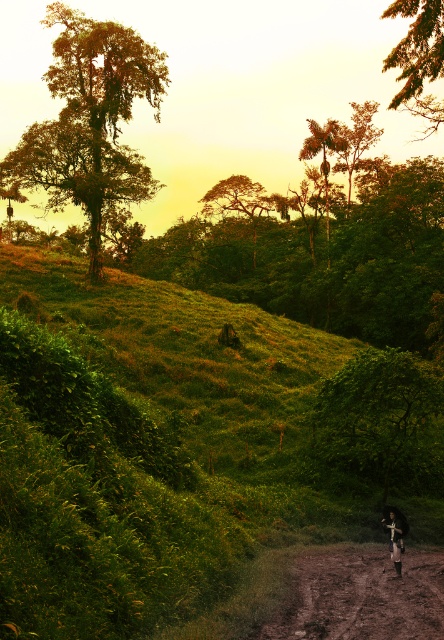
Question: Which object is positioned closest to the green leafy tree at upper right?

Choices:
 (A) brown dirt track at lower right
 (B) green leafy tree at upper left
 (C) green leafy tree at center

Answer: (B)

Question: Which point is farther to the camera?

Choices:
 (A) (388, 516)
 (B) (67, 88)
 (C) (424, 1)

Answer: (B)

Question: Is green leafy tree at upper left smaller than brown dirt track at lower right?

Choices:
 (A) yes
 (B) no

Answer: (B)

Question: Among these objects, which one is farthest from the camera?

Choices:
 (A) green leafy tree at center
 (B) green leafy tree at upper right
 (C) green leafy tree at upper left
 (D) dark blue fabric mountain biker at center

Answer: (C)

Question: Does green leafy tree at center have a smaller size compared to dark blue fabric mountain biker at center?

Choices:
 (A) no
 (B) yes

Answer: (B)

Question: Does green leafy tree at center appear under brown dirt track at lower right?

Choices:
 (A) yes
 (B) no

Answer: (B)